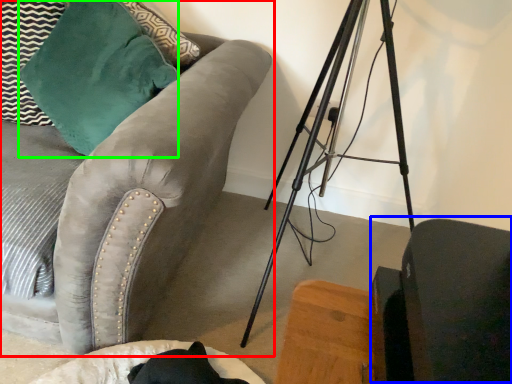
Question: Based on their relative distances, which object is nearer to studio couch (highlighted by a red box)? Choose from swivel chair (highlighted by a blue box) and throw pillow (highlighted by a green box).

Choices:
 (A) swivel chair
 (B) throw pillow

Answer: (B)